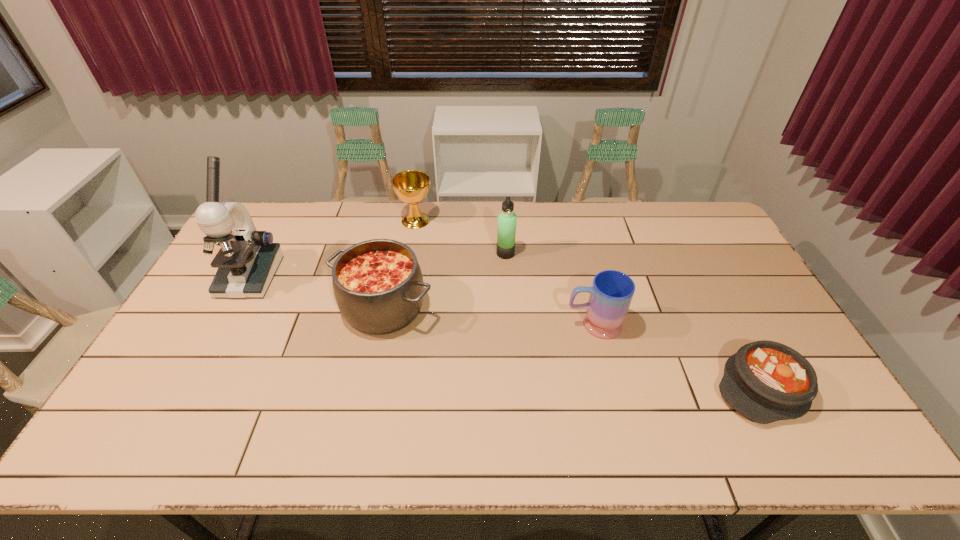
Where is `microscope`? This screenshot has height=540, width=960. microscope is located at coordinates (248, 259).

Find the location of a particular element. the tallest object is located at coordinates (248, 259).

This screenshot has height=540, width=960. What are the coordinates of `the fourth object from left to right` in the screenshot? It's located at (506, 231).

Where is `thermos bottle`? This screenshot has height=540, width=960. thermos bottle is located at coordinates (506, 231).

Find the location of `chalice`. chalice is located at coordinates (411, 186).

Where is `the left casserole`? the left casserole is located at coordinates (378, 286).

Locate an element on the screen. The image size is (960, 540). the taller casserole is located at coordinates (378, 286).

I want to click on mug, so click(611, 293).

This screenshot has width=960, height=540. What are the coordinates of `the nearest object` in the screenshot? It's located at (765, 381).

Locate an element on the screen. the shorter casserole is located at coordinates (765, 381).